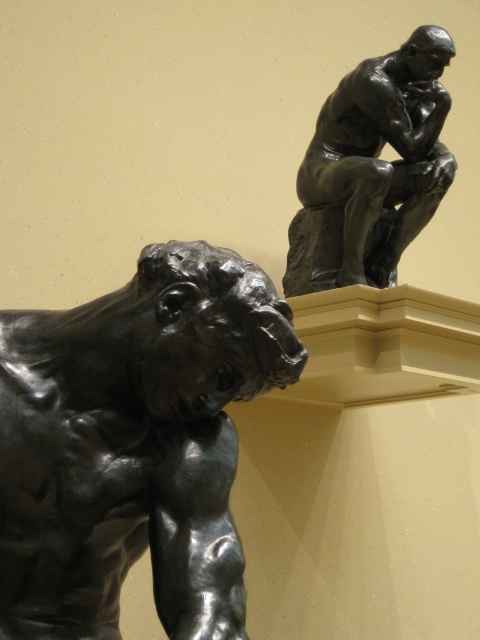
Question: Is polished bronze muscular figure at lower left to the left of bronze statue at upper right from the viewer's perspective?

Choices:
 (A) yes
 (B) no

Answer: (A)

Question: Which point appears closest to the camera in this image?

Choices:
 (A) (436, 109)
 (B) (113, 362)

Answer: (B)

Question: Can you confirm if polished bronze muscular figure at lower left is wider than bronze statue at upper right?

Choices:
 (A) no
 (B) yes

Answer: (A)

Question: Is polished bronze muscular figure at lower left above bronze statue at upper right?

Choices:
 (A) yes
 (B) no

Answer: (B)

Question: Which point is closer to the camera?

Choices:
 (A) polished bronze muscular figure at lower left
 (B) bronze statue at upper right

Answer: (A)